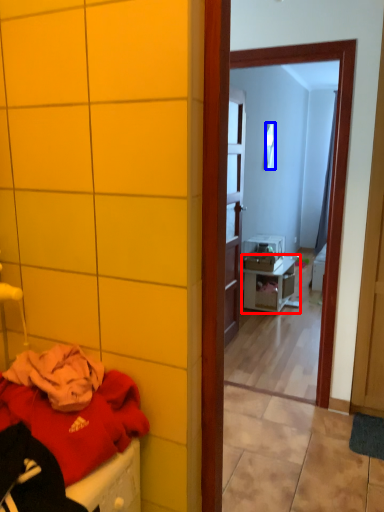
Question: Among these objects, which one is farthest to the camera, nightstand (highlighted by a red box) or mirror (highlighted by a blue box)?

Choices:
 (A) nightstand
 (B) mirror

Answer: (B)